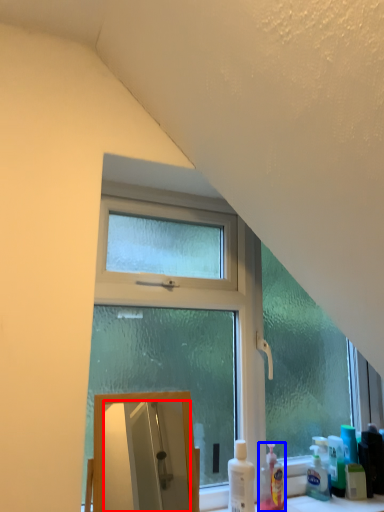
Question: Which object appears closest to the camera in this image, mirror (highlighted by a red box) or cleaning product (highlighted by a blue box)?

Choices:
 (A) mirror
 (B) cleaning product

Answer: (A)